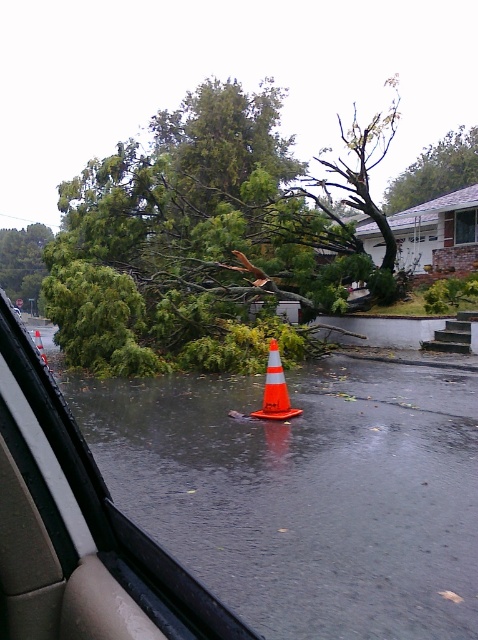
Question: Is green leafy tree at upper center to the left of orange reflective cone at center from the viewer's perspective?

Choices:
 (A) no
 (B) yes

Answer: (A)

Question: In this image, where is green leafy tree at upper center located relative to green leafy tree at left?

Choices:
 (A) left
 (B) right

Answer: (B)

Question: Does wet asphalt flood at lower center have a smaller size compared to green leafy tree at upper center?

Choices:
 (A) yes
 (B) no

Answer: (A)

Question: Based on their relative distances, which object is farther from the green leafy tree at upper center?

Choices:
 (A) green leafy tree at left
 (B) wet asphalt flood at lower center
 (C) green leafy tree at center
 (D) orange reflective cone at center

Answer: (D)

Question: Which of the following is the farthest from the observer?

Choices:
 (A) green leafy tree at center
 (B) wet asphalt flood at lower center
 (C) green leafy tree at upper center
 (D) green leafy tree at left

Answer: (D)

Question: Estimate the real-world distances between objects in this image. Which object is closer to the wet asphalt flood at lower center?

Choices:
 (A) green leafy tree at left
 (B) green leafy tree at upper center
 (C) orange reflective cone at center

Answer: (C)